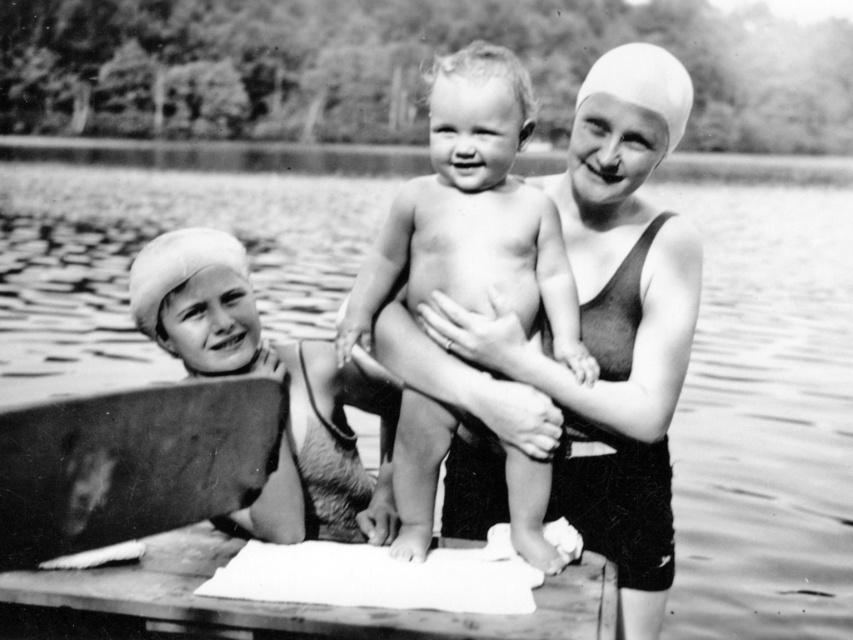
You are standing at the edge of the dock and want to place a small potted plant between the two points, point (x=509, y=88) and point (x=267, y=518). Which point should the plant be closer to so it appears larger in the photo?

The plant should be placed closer to point (x=509, y=88) because it is closer to the viewer, making it appear larger in the photo.

You are a photographer taking a portrait of the smooth skin baby at center and the smooth white swim cap at left. Which object appears narrower in the photo?

The smooth skin baby at center appears narrower than the smooth white swim cap at left in the photo.

You are a lifeguard at the lakeside and need to retrieve the smooth white swim cap at left that is floating away. The smooth skin baby at center is currently in your arms. Can you reach the swim cap without letting go of the baby?

The distance between the smooth skin baby at center and the smooth white swim cap at left is 31.67 inches. Since the baby is in your arms, you would need to extend your arm to reach the swim cap. The average adult arm span is about 30 inches, so you might not be able to reach it without letting go of the baby. It would be safer to put the baby down first before attempting to retrieve the swim cap.